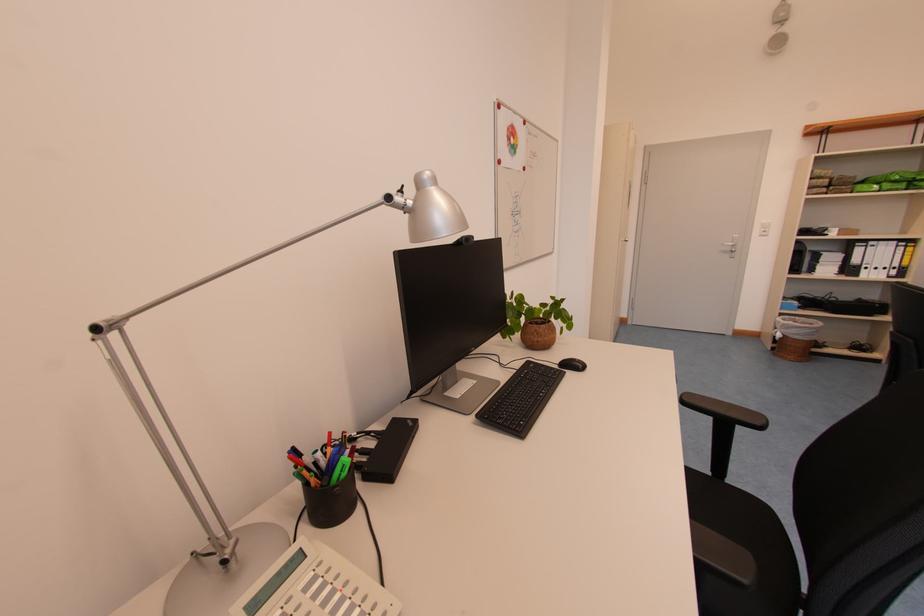
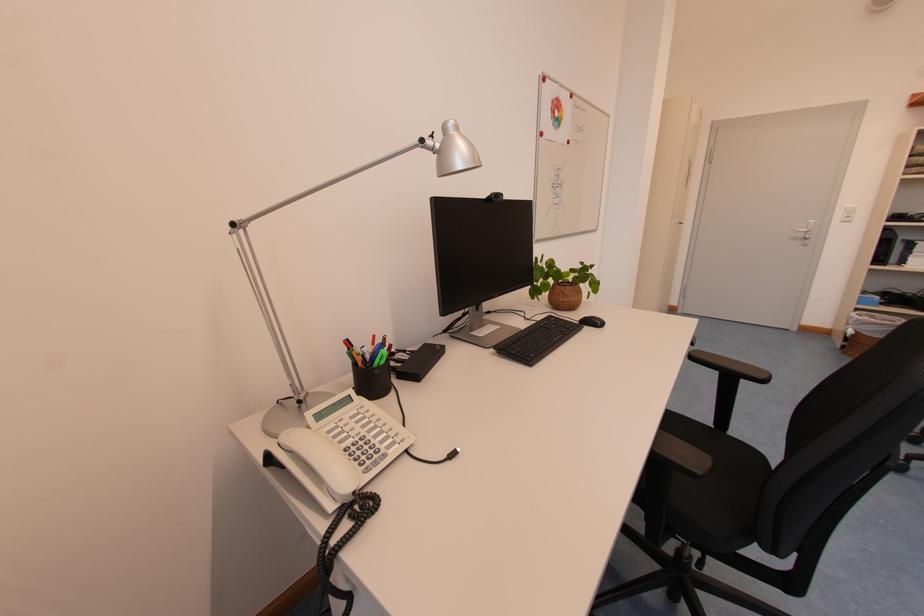
Question: The camera is either moving clockwise (left) or counter-clockwise (right) around the object. The first image is from the beginning of the video and the second image is from the end. Is the camera moving left or right when shooting the video?

Choices:
 (A) Left
 (B) Right

Answer: (B)